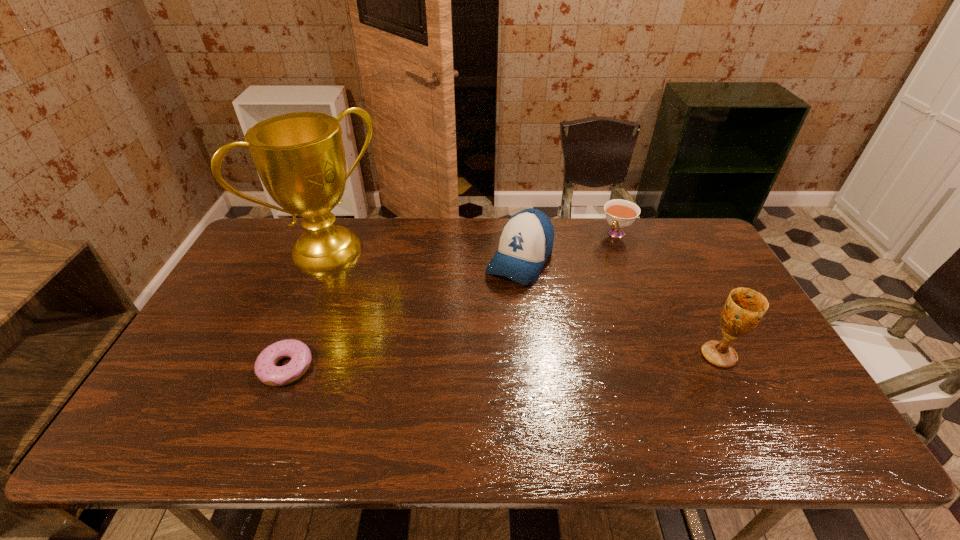
Identify the location of the shortest object. The width and height of the screenshot is (960, 540). (267, 372).

Locate an element on the screen. Image resolution: width=960 pixels, height=540 pixels. the second tallest object is located at coordinates (744, 308).

In order to click on the rightmost object in this screenshot , I will do `click(744, 308)`.

The width and height of the screenshot is (960, 540). I want to click on the third tallest object, so click(x=526, y=241).

Find the location of a particular element. the third object from right to left is located at coordinates (526, 241).

Locate an element on the screen. award is located at coordinates (300, 158).

Find the location of a particular element. Image resolution: width=960 pixels, height=540 pixels. teacup is located at coordinates (620, 214).

What are the coordinates of `the fourth object from left to right` in the screenshot? It's located at (620, 214).

Locate an element on the screen. The width and height of the screenshot is (960, 540). blank area located on the right of the doughnut is located at coordinates tap(456, 367).

I want to click on free space located on the back of the rightmost object, so click(696, 310).